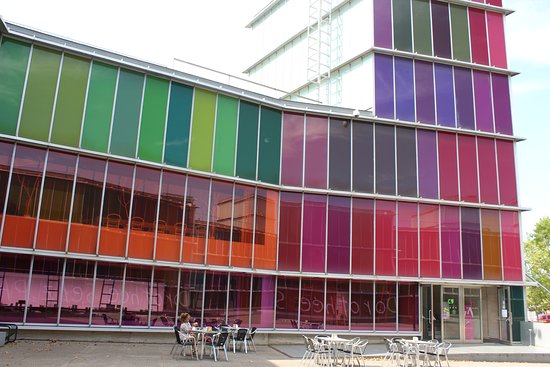
You are a GUI agent. You are given a task and a screenshot of the screen. Output one action in this format:
    pyautogui.click(x=<x>, y=<y>)
    Task: Click on the purple windows
    
    Given the screenshot: What is the action you would take?
    pyautogui.click(x=442, y=46), pyautogui.click(x=414, y=104), pyautogui.click(x=470, y=244), pyautogui.click(x=412, y=178), pyautogui.click(x=335, y=225), pyautogui.click(x=461, y=106)